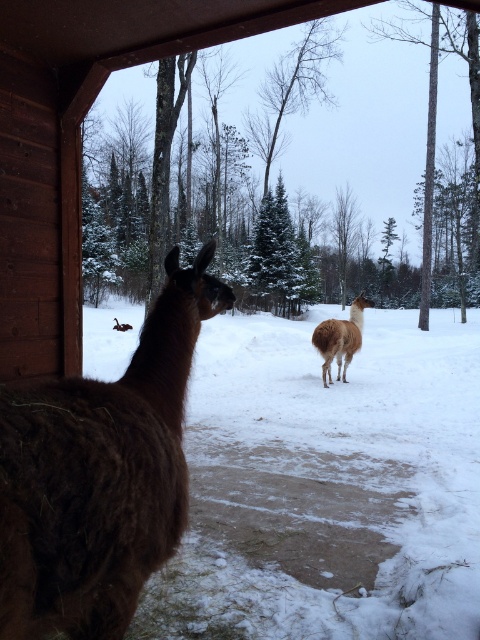
You are a farmer checking the alpacas in the barn. You notice the brown fuzzy alpaca at left and the brown woolly alpaca at center. Which alpaca is taller?

The brown fuzzy alpaca at left is taller than the brown woolly alpaca at center according to the description.

You are standing inside the wooden structure and want to walk from the entrance to the brown woolly alpaca at center. Which direction should you move relative to the brown fuzzy alpaca at left?

You should move to the right of the brown fuzzy alpaca at left to reach the brown woolly alpaca at center since the brown fuzzy alpaca at left is positioned to the left of the brown woolly alpaca at center.